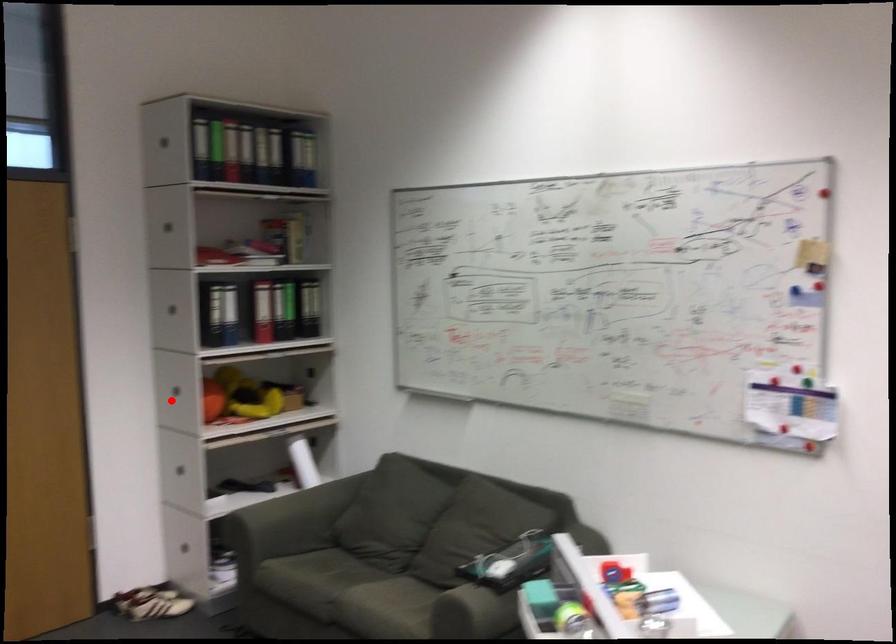
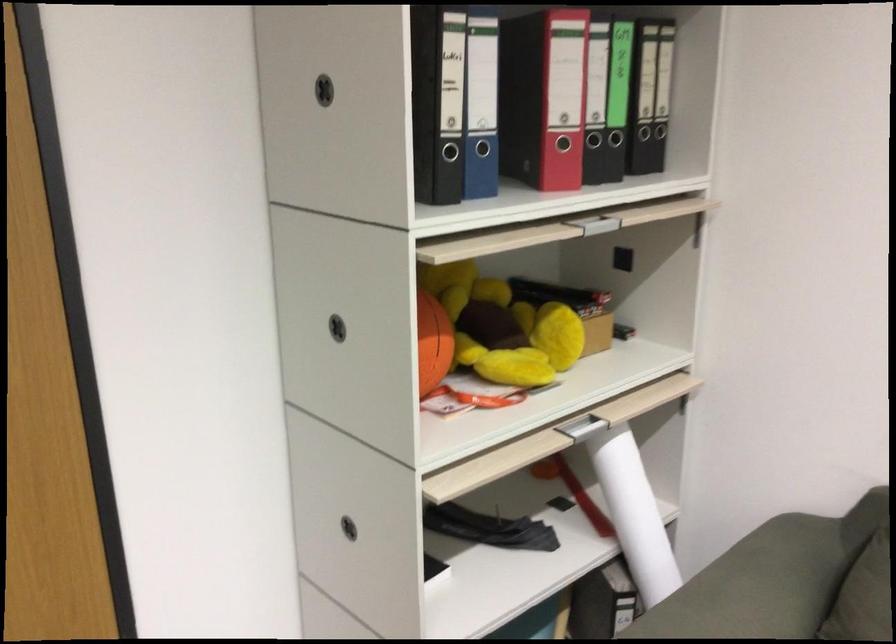
Question: A red point is marked in image1. In image2, is the corresponding 3D point closer to the camera or farther? Reply with the corresponding letter.

Choices:
 (A) The corresponding 3D point is closer.
 (B) The corresponding 3D point is farther.

Answer: (A)